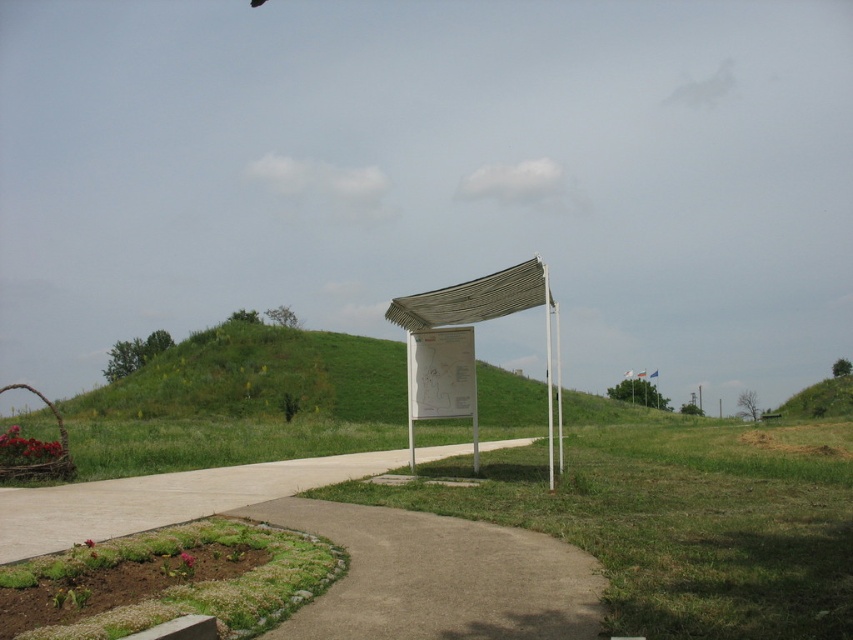
You are a park visitor who wants to read the white plastic sign at center. You are currently standing on the light gray concrete pavement at lower left. Can you reach the sign by walking straight ahead?

The white plastic sign at center has a larger size compared to light gray concrete pavement at lower left, but since the sign is in the center and you are on the pavement at lower left, walking straight ahead might not be the best path. You should check the direction of the path to ensure you can reach it.

You are standing at point [473,312] and want to walk to the white informational signpost in the center. Is the point [286,376] between you and the signpost?

Point [286,376] is behind point [473,312], so it is not between you and the signpost. You can walk towards the signpost without passing through point [286,376].